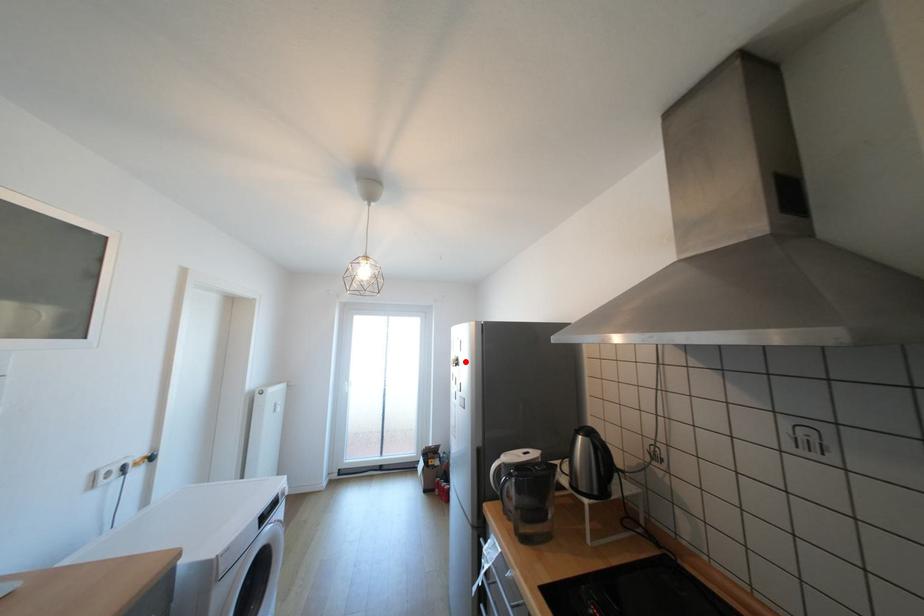
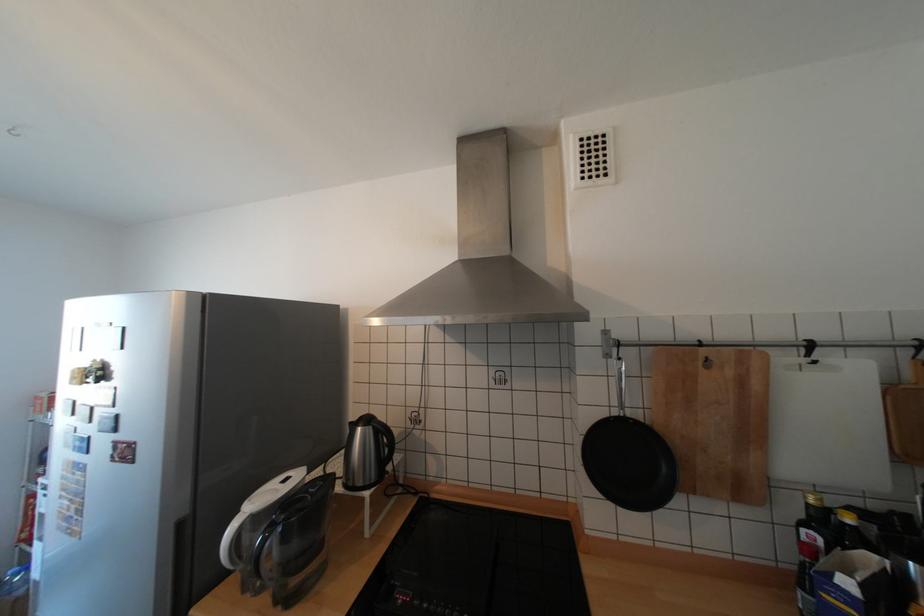
Locate, in the second image, the point that corresponds to the highlighted location in the first image.

(108, 373)